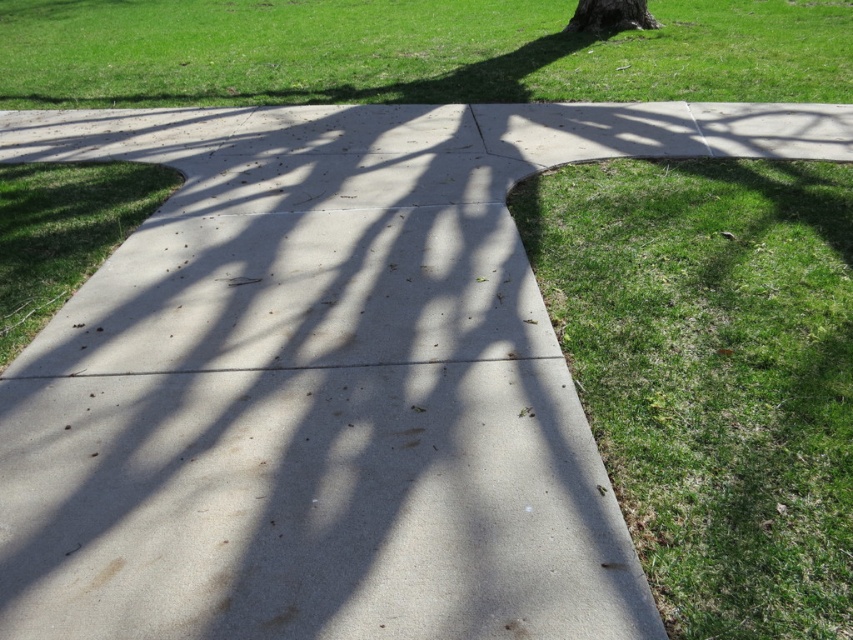
Between point (189, 17) and point (621, 3), which one is positioned behind?

Positioned behind is point (189, 17).

Who is more distant from viewer, (74, 65) or (599, 10)?

The point (599, 10) is more distant.

Find the location of a particular element. The width and height of the screenshot is (853, 640). green grass at upper center is located at coordinates (415, 52).

Describe the element at coordinates (712, 376) in the screenshot. I see `green grass at lower right` at that location.

Can you confirm if green grass at lower right is positioned to the right of green rough bark tree at upper center?

No, green grass at lower right is not to the right of green rough bark tree at upper center.

Between point (798, 499) and point (590, 17), which one is positioned behind?

Positioned behind is point (590, 17).

Where is `green grass at lower right`? The width and height of the screenshot is (853, 640). green grass at lower right is located at coordinates (712, 376).

Who is positioned more to the left, green grass at lower right or green grass at upper center?

Positioned to the left is green grass at upper center.

This screenshot has width=853, height=640. I want to click on green grass at lower right, so click(x=712, y=376).

Locate an element on the screen. The width and height of the screenshot is (853, 640). green grass at lower right is located at coordinates (712, 376).